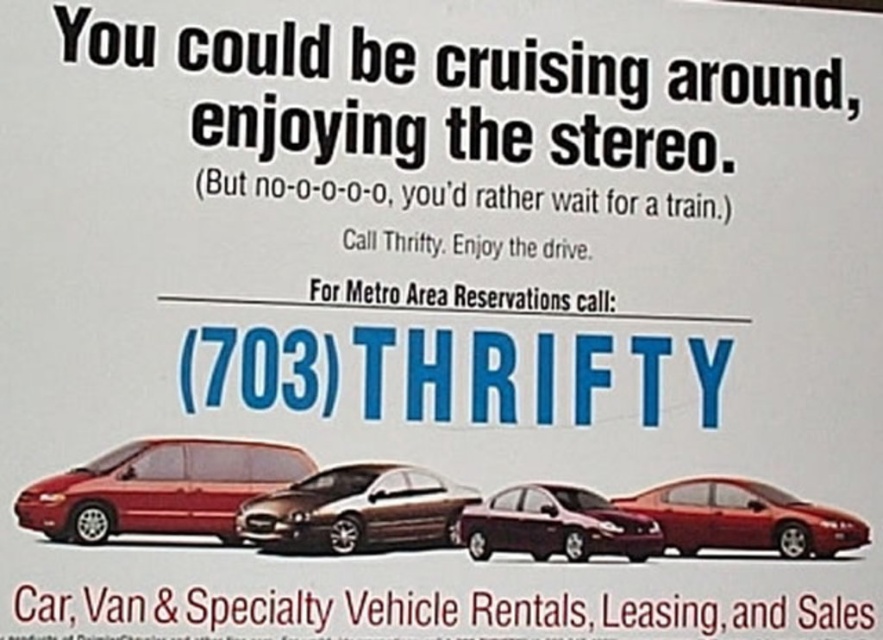
In the Thrifty car rental advertisement, there is a point labeled at coordinates (x=157, y=488). Which vehicle in the image does this point belong to?

The point labeled at coordinates (x=157, y=488) is on the matte red minivan at left.